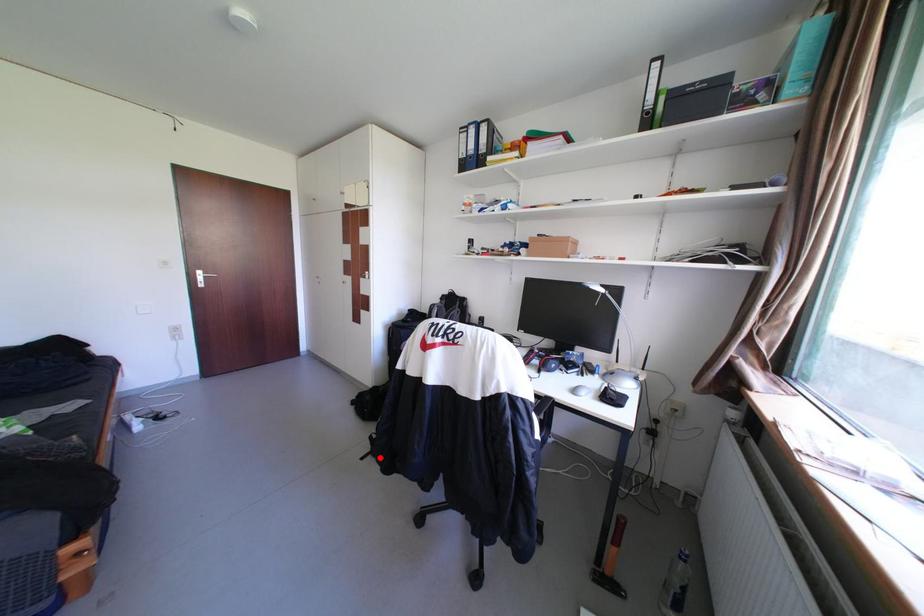
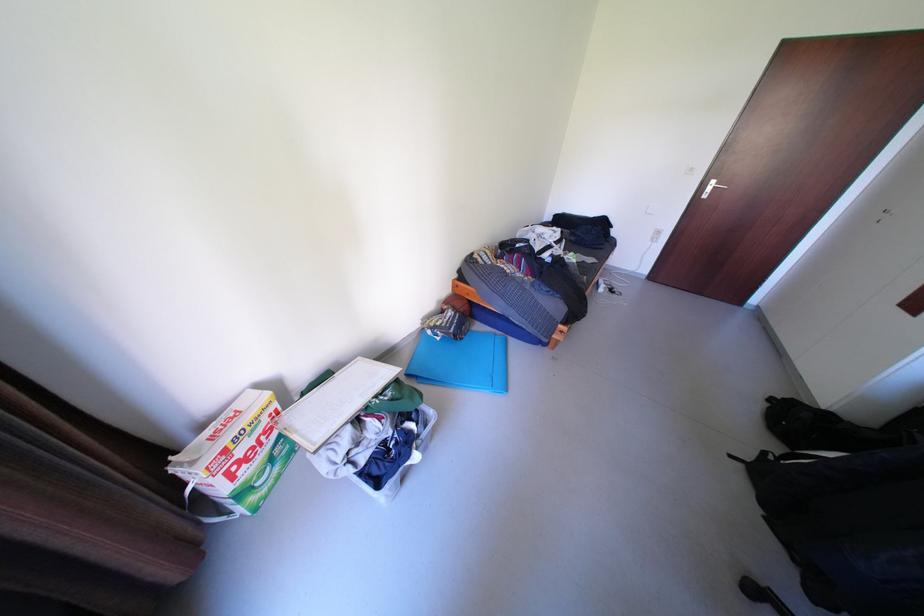
Question: I am providing you with two images of the same scene from different viewpoints. In image1, a red point is highlighted. Considering the same 3D point in image2, which of the following is correct?

Choices:
 (A) It is closer
 (B) It is farther

Answer: (A)